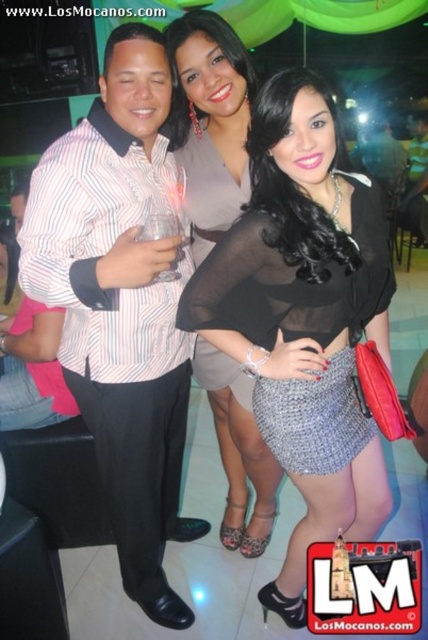
The height and width of the screenshot is (640, 428). Describe the element at coordinates (121, 304) in the screenshot. I see `striped cotton shirt at center` at that location.

You are a GUI agent. You are given a task and a screenshot of the screen. Output one action in this format:
    pyautogui.click(x=<x>, y=<y>)
    Task: Click on the striped cotton shirt at center
    The width and height of the screenshot is (428, 640).
    Given the screenshot: What is the action you would take?
    (x=121, y=304)

Which is more to the right, black sheer blouse at center or striped cotton shirt at center?

Positioned to the right is black sheer blouse at center.

Is black sheer blouse at center smaller than striped cotton shirt at center?

Yes.

Which is behind, point (326, 193) or point (177, 444)?

The point (177, 444) is more distant.

Find the location of a particular element. black sheer blouse at center is located at coordinates (303, 317).

Between point (296, 109) and point (234, 387), which one is positioned in front?

Point (296, 109)

Is point (287, 131) positioned in front of point (234, 388)?

Yes, point (287, 131) is closer to viewer.

Identify the location of black sheer blouse at center. (303, 317).